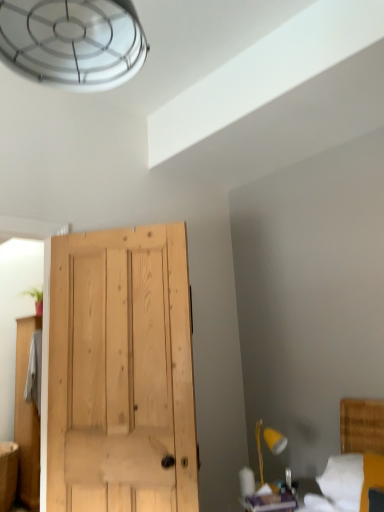
Question: Considering the positions of white fabric bed at lower right and matte wood vanity at lower left in the image, is white fabric bed at lower right wider or thinner than matte wood vanity at lower left?

Choices:
 (A) wide
 (B) thin

Answer: (A)

Question: Is white fabric bed at lower right situated inside matte wood vanity at lower left or outside?

Choices:
 (A) inside
 (B) outside

Answer: (B)

Question: Which is nearer to the matte wood vanity at lower left?

Choices:
 (A) yellow wood lamp at lower right
 (B) white fabric bed at lower right

Answer: (A)

Question: Which of these objects is positioned farthest from the yellow wood lamp at lower right?

Choices:
 (A) white fabric bed at lower right
 (B) matte wood vanity at lower left

Answer: (B)